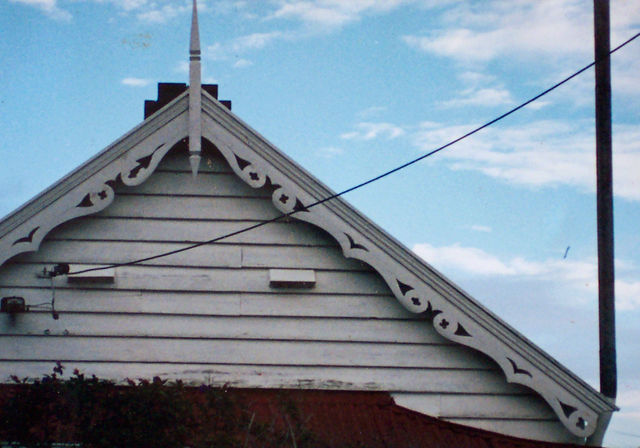
Where is `red canopy`? red canopy is located at coordinates (388, 437).